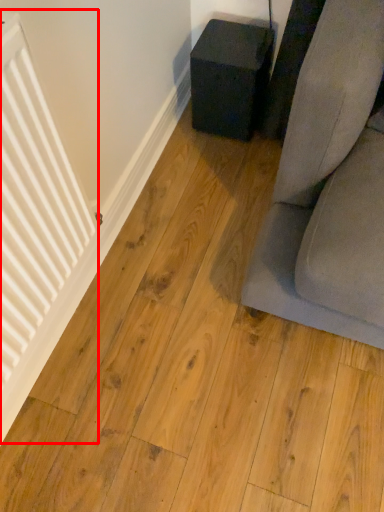
Question: From the image's perspective, where is radiator (annotated by the red box) located relative to furniture?

Choices:
 (A) below
 (B) above

Answer: (A)